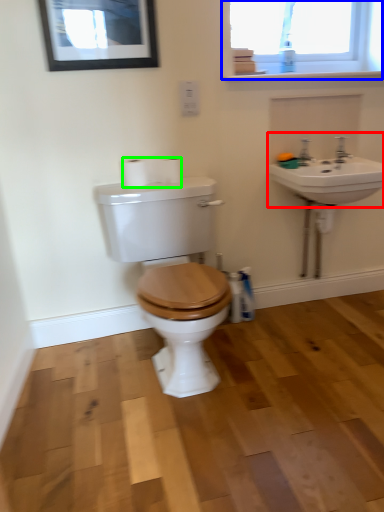
Question: Which object is the closest to the sink (highlighted by a red box)? Choose among these: window (highlighted by a blue box) or toilet paper (highlighted by a green box).

Choices:
 (A) window
 (B) toilet paper

Answer: (A)